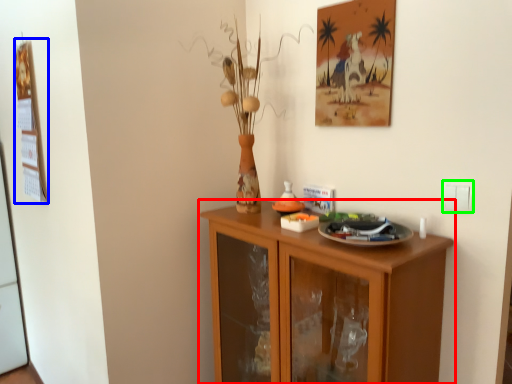
Question: Considering the real-world distances, which object is farthest from cabinetry (highlighted by a red box)? picture frame (highlighted by a blue box) or electric outlet (highlighted by a green box)?

Choices:
 (A) picture frame
 (B) electric outlet

Answer: (A)